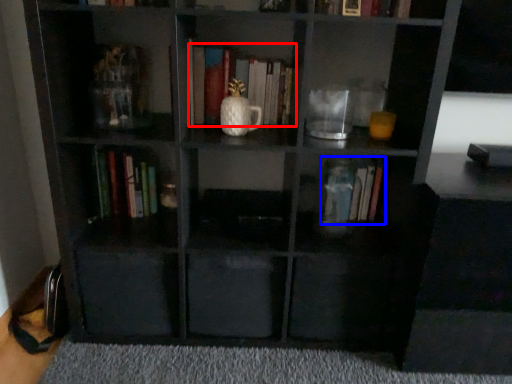
Question: Which object appears farthest to the camera in this image, book (highlighted by a red box) or book (highlighted by a blue box)?

Choices:
 (A) book
 (B) book

Answer: (B)